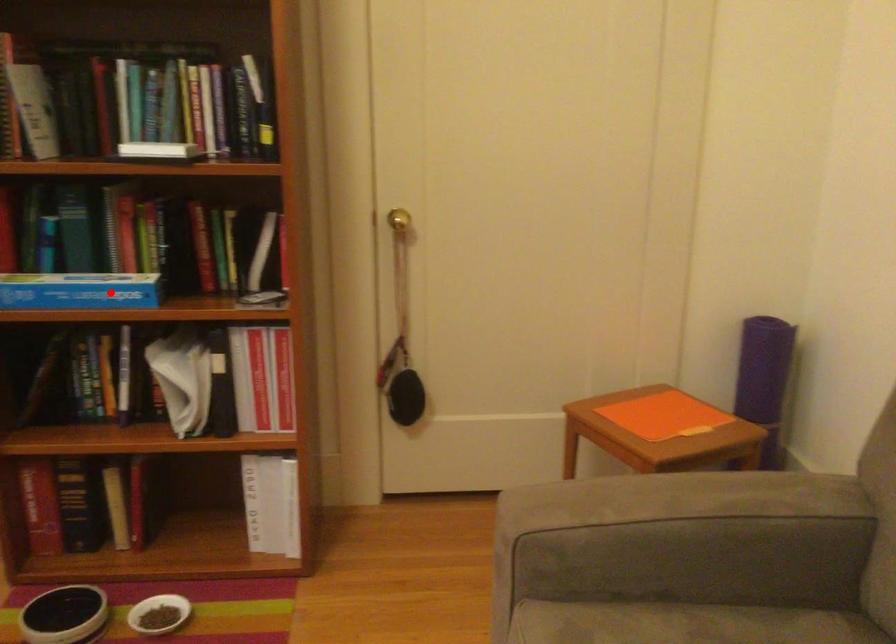
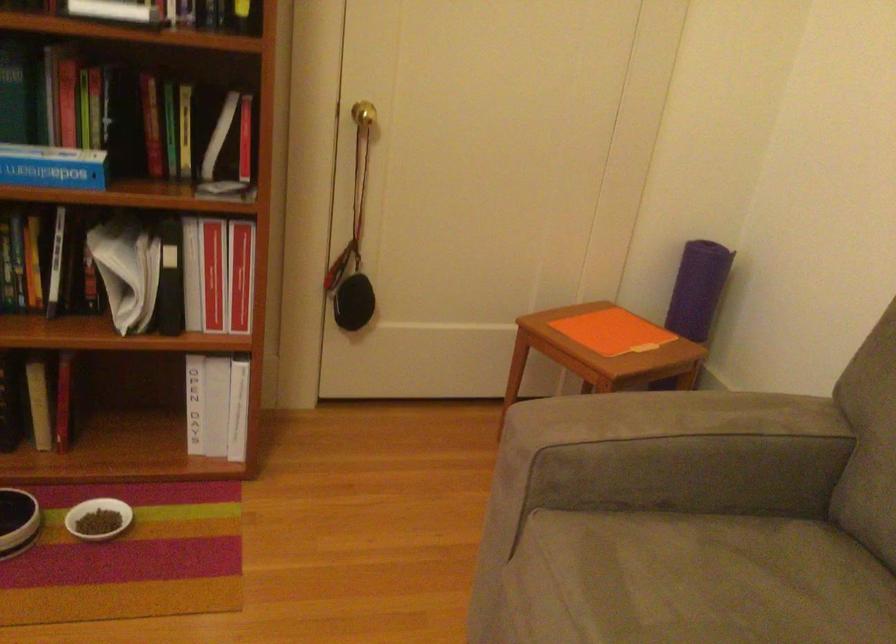
Question: I am providing you with two images of the same scene from different viewpoints. A red point is marked on the first image. Is the red point's position out of view in image 2?

Choices:
 (A) Yes
 (B) No

Answer: (B)